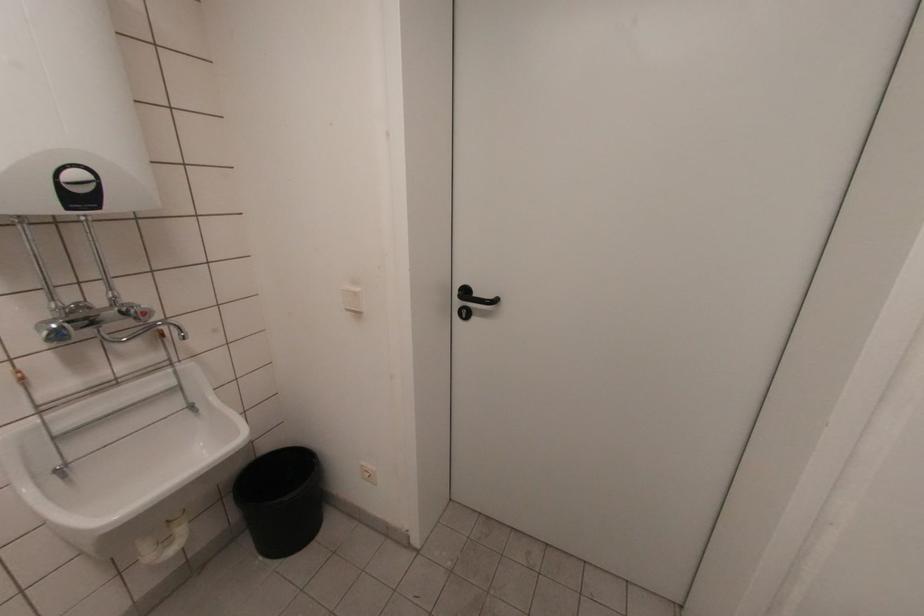
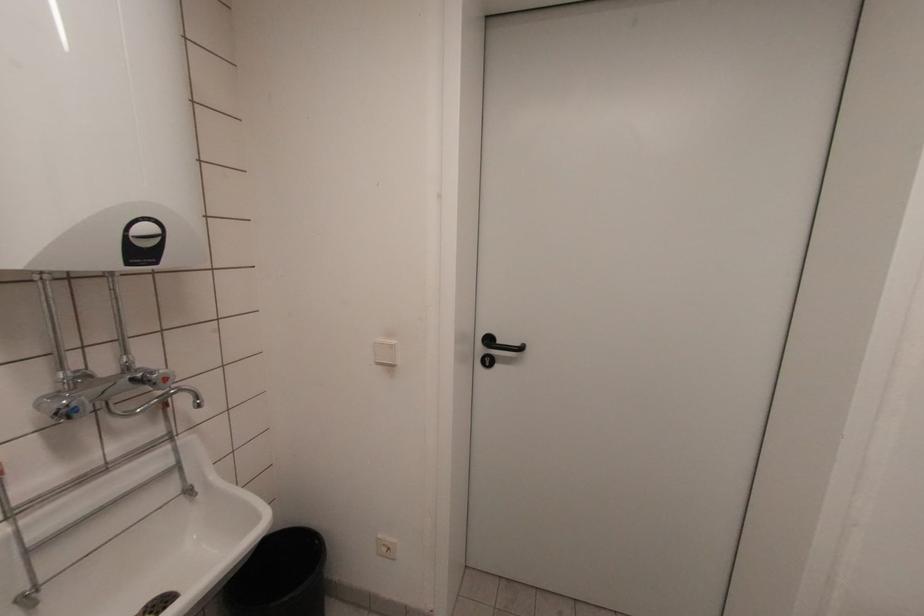
In the second image, find the point that corresponds to [465,315] in the first image.

(488, 363)